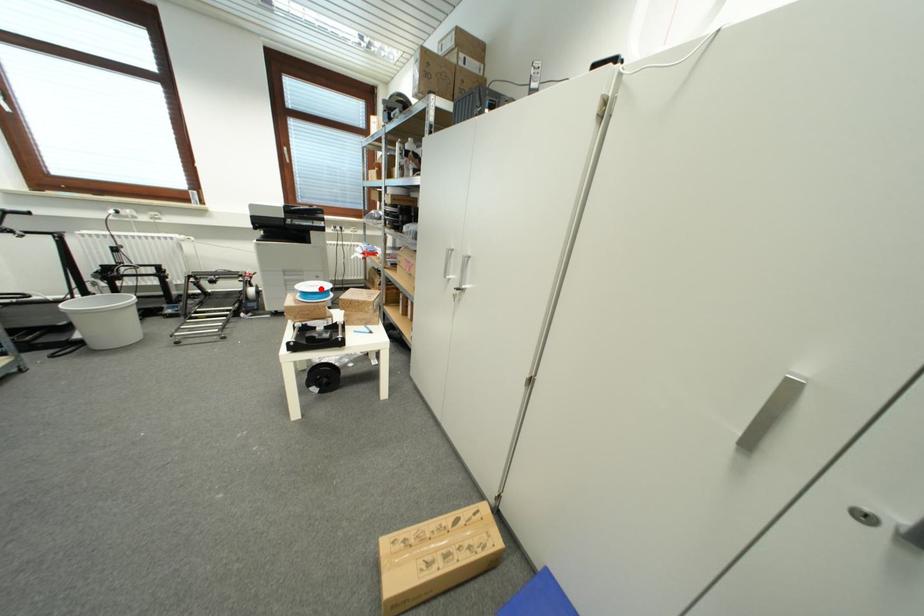
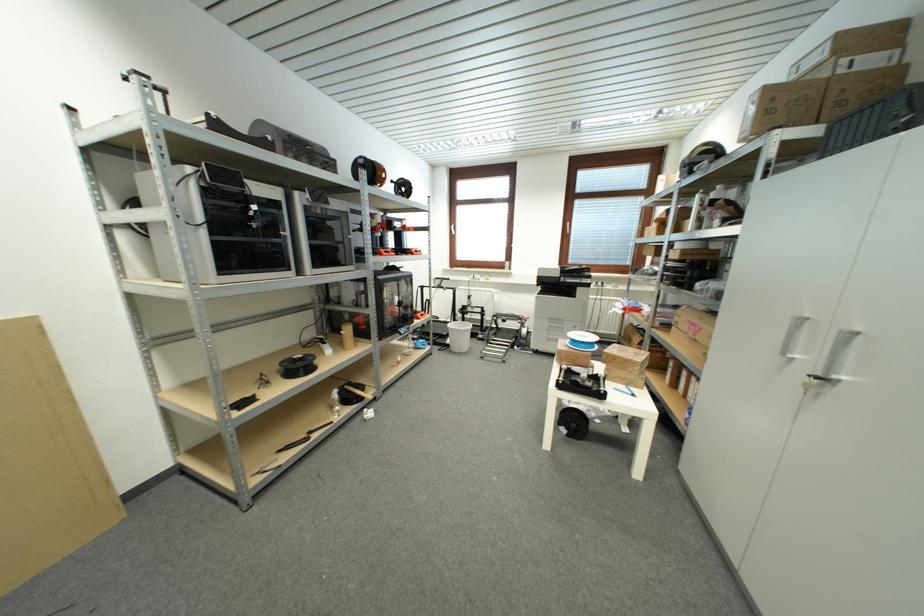
In the second image, find the point that corresponds to the highlighted location in the first image.

(590, 339)